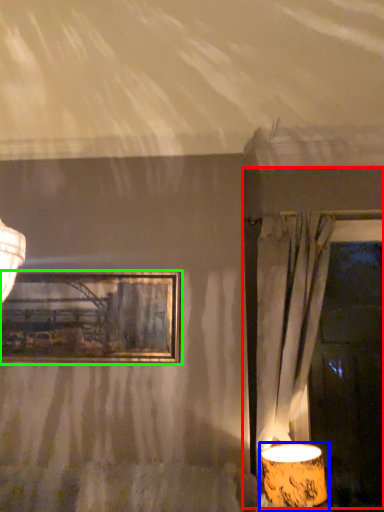
Question: Which is nearer to the window frame (highlighted by a red box)? lamp (highlighted by a blue box) or picture frame (highlighted by a green box).

Choices:
 (A) lamp
 (B) picture frame

Answer: (A)